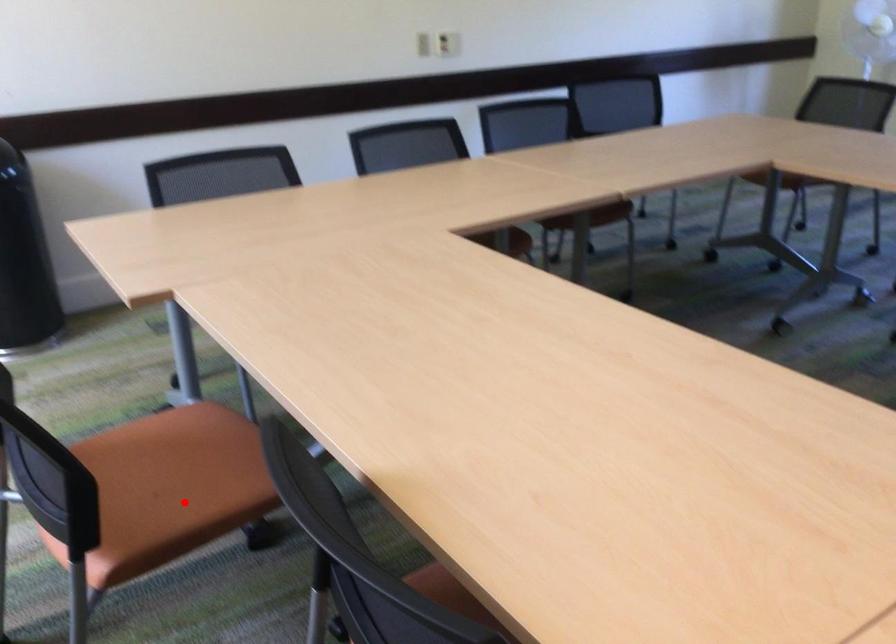
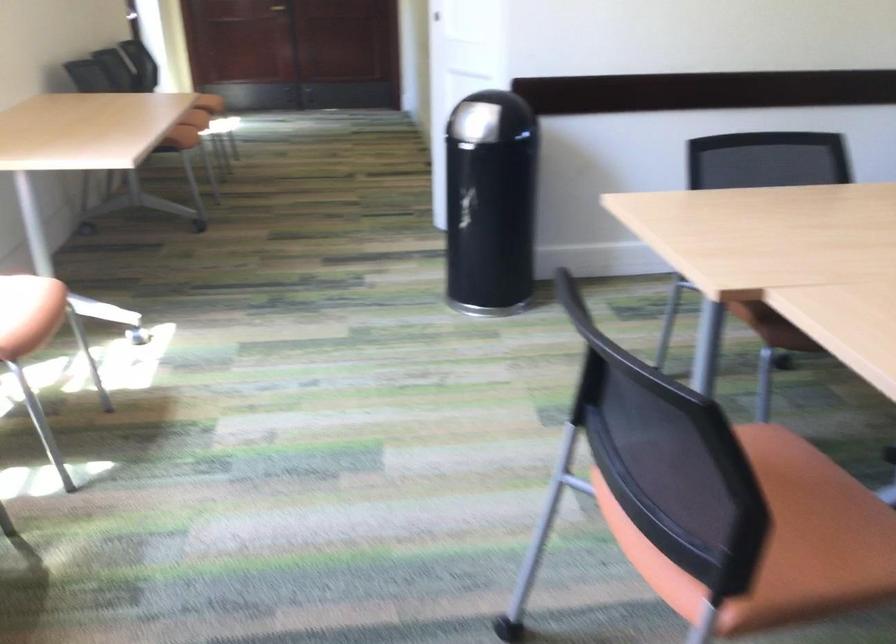
The point at the highlighted location is marked in the first image. Where is the corresponding point in the second image?

(782, 540)